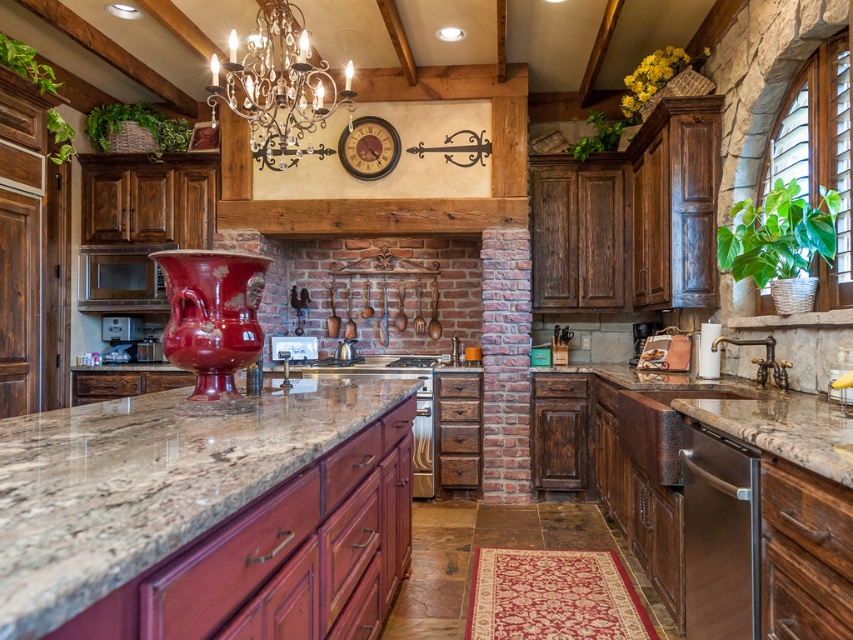
Can you confirm if satin stainless steel dishwasher at lower right is positioned to the left of silver metallic chandelier at upper center?

No, satin stainless steel dishwasher at lower right is not to the left of silver metallic chandelier at upper center.

Can you confirm if satin stainless steel dishwasher at lower right is thinner than silver metallic chandelier at upper center?

Indeed, satin stainless steel dishwasher at lower right has a lesser width compared to silver metallic chandelier at upper center.

Find the location of a particular element. This screenshot has height=640, width=853. satin stainless steel dishwasher at lower right is located at coordinates (720, 536).

Is point (305, 380) less distant than point (279, 70)?

Yes, it is.

Who is more distant from viewer, (224, 449) or (283, 32)?

Positioned behind is point (283, 32).

Describe the element at coordinates (146, 483) in the screenshot. I see `brown granite countertop at center` at that location.

This screenshot has width=853, height=640. Find the location of `brown granite countertop at center`. brown granite countertop at center is located at coordinates (146, 483).

Is brown granite countertop at center above satin stainless steel dishwasher at lower right?

Yes.

Does brown granite countertop at center lie in front of satin stainless steel dishwasher at lower right?

That is True.

Which is behind, point (296, 461) or point (735, 563)?

The point (735, 563) is behind.

The width and height of the screenshot is (853, 640). I want to click on brown granite countertop at center, so click(x=146, y=483).